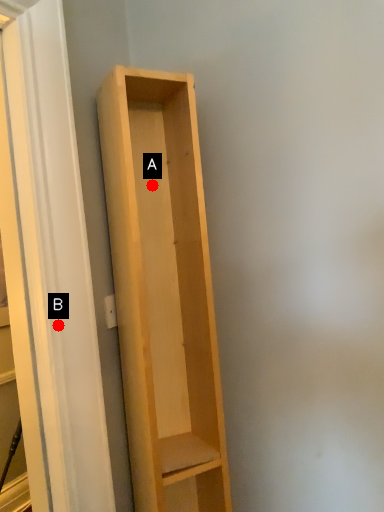
Question: Two points are circled on the image, labeled by A and B beside each circle. Which point is further to the camera?

Choices:
 (A) A is further
 (B) B is further

Answer: (A)